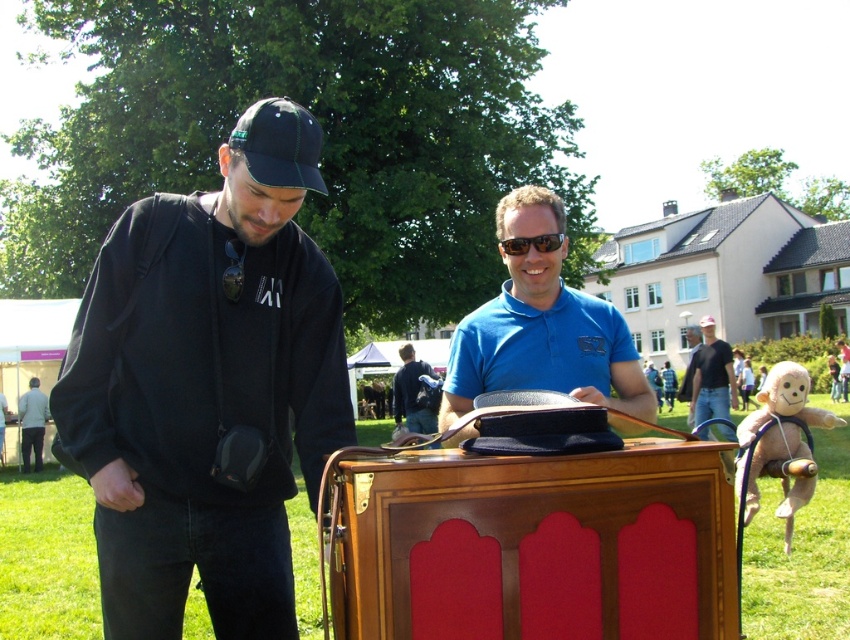
Where is `plush beige monkey at lower right`? The image size is (850, 640). plush beige monkey at lower right is located at coordinates (782, 406).

Does plush beige monkey at lower right appear on the left side of denim jeans at center?

Yes, plush beige monkey at lower right is to the left of denim jeans at center.

Locate an element on the screen. plush beige monkey at lower right is located at coordinates (782, 406).

Can you confirm if black matte jacket at left is smaller than black plastic sunglasses at center?

Incorrect, black matte jacket at left is not smaller in size than black plastic sunglasses at center.

Is point (276, 560) behind point (534, 244)?

That is False.

At what (x,y) coordinates should I click in order to perform the action: click on black matte jacket at left. Please return your answer as a coordinate pair (x, y). Image resolution: width=850 pixels, height=640 pixels. Looking at the image, I should click on (207, 387).

Is point (688, 356) less distant than point (547, 248)?

No, it is behind (547, 248).

Who is more distant from viewer, (x=697, y=340) or (x=554, y=244)?

Point (x=697, y=340)

The width and height of the screenshot is (850, 640). Find the location of `blue smooth shirt at center`. blue smooth shirt at center is located at coordinates (689, 364).